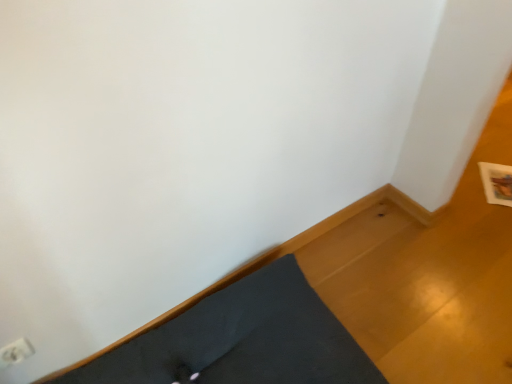
Question: Considering the positions of dark gray fabric bed frame at lower left and white plastic electric outlet at lower left in the image, is dark gray fabric bed frame at lower left wider or thinner than white plastic electric outlet at lower left?

Choices:
 (A) wide
 (B) thin

Answer: (A)

Question: Looking at the image, does dark gray fabric bed frame at lower left seem bigger or smaller compared to white plastic electric outlet at lower left?

Choices:
 (A) big
 (B) small

Answer: (A)

Question: Is point (307, 317) closer or farther from the camera than point (26, 354)?

Choices:
 (A) farther
 (B) closer

Answer: (A)

Question: Considering the positions of white plastic electric outlet at lower left and dark gray fabric bed frame at lower left in the image, is white plastic electric outlet at lower left wider or thinner than dark gray fabric bed frame at lower left?

Choices:
 (A) wide
 (B) thin

Answer: (B)

Question: Based on their sizes in the image, would you say white plastic electric outlet at lower left is bigger or smaller than dark gray fabric bed frame at lower left?

Choices:
 (A) small
 (B) big

Answer: (A)

Question: From the image's perspective, is white plastic electric outlet at lower left above or below dark gray fabric bed frame at lower left?

Choices:
 (A) above
 (B) below

Answer: (A)

Question: Is point (19, 357) positioned closer to the camera than point (208, 360)?

Choices:
 (A) farther
 (B) closer

Answer: (B)